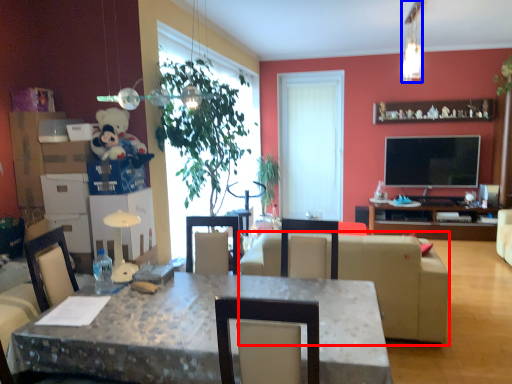
Question: Which object is further to the camera taking this photo, studio couch (highlighted by a red box) or lamp (highlighted by a blue box)?

Choices:
 (A) studio couch
 (B) lamp

Answer: (B)